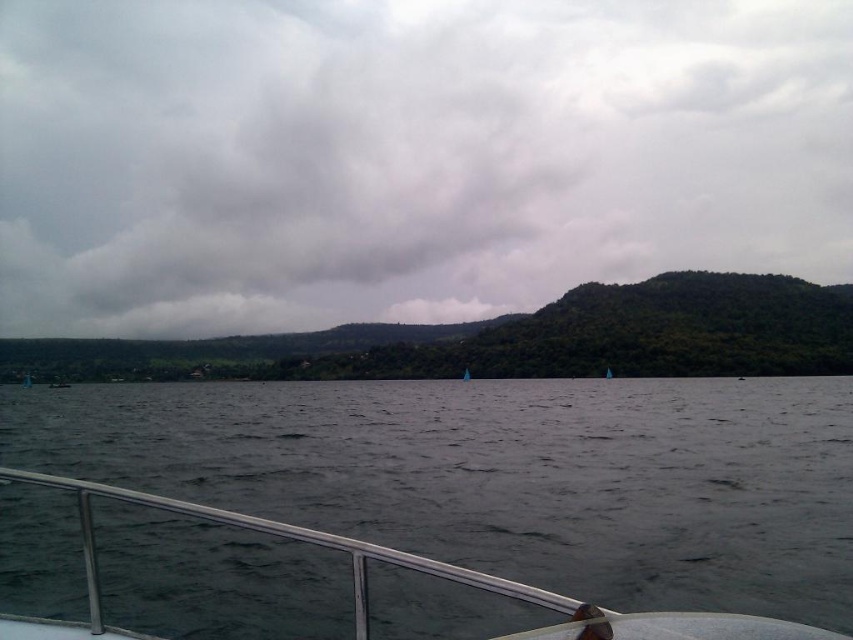
Looking at this image, you are standing on the deck of a boat and looking out at the scene. Which object is positioned higher relative to the other? The cloudy sky at upper center or the dark gray water at center?

The cloudy sky at upper center is located above the dark gray water at center, so it is positioned higher relative to the other.

Looking at this image, you are standing on the boat deck and looking out. Which object is closer to you between the cloudy sky at upper center and the dark gray water at center?

The cloudy sky at upper center is closer to you than the dark gray water at center because it is further to the viewer.

You are standing on the boat deck and want to take a photo of the cloudy sky at upper center and dark gray water at center. Which object is located to the right side of the other?

The cloudy sky at upper center is to the right of dark gray water at center according to the description.